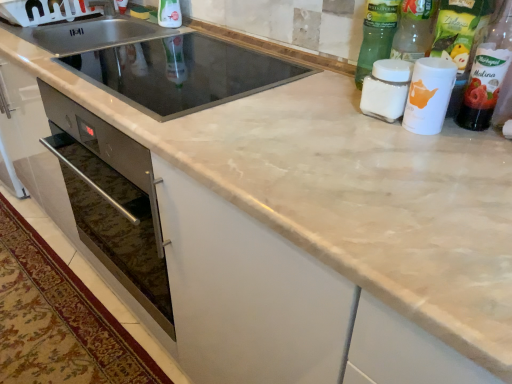
I want to click on vacant space situated on the left part of white plastic cup at upper right, the second bottle positioned from the right, so click(344, 107).